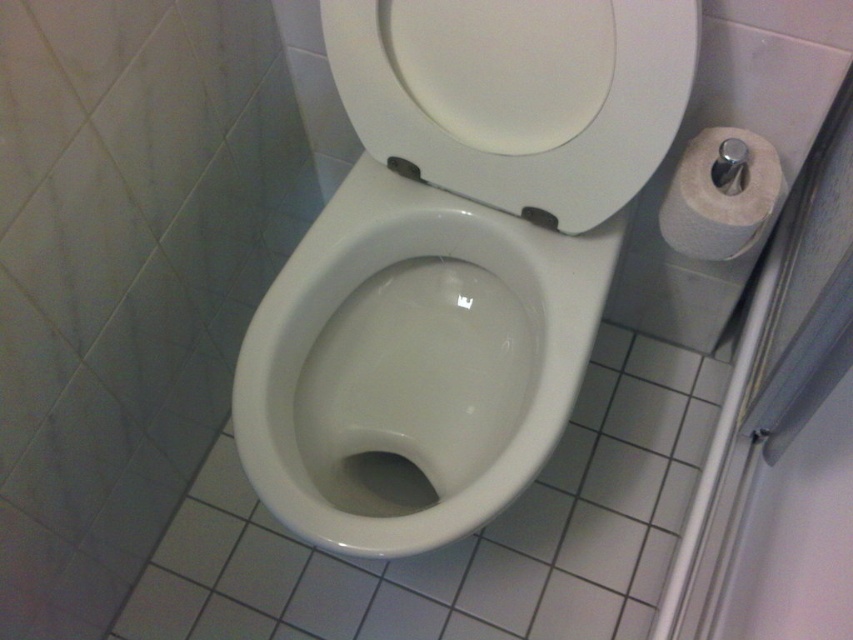
Question: Where is white glossy toilet bowl at center located in relation to white glossy toilet seat at center in the image?

Choices:
 (A) above
 (B) below

Answer: (B)

Question: Which point is farther to the camera?

Choices:
 (A) (758, 220)
 (B) (341, 264)

Answer: (B)

Question: Which object is positioned farthest from the white glossy toilet at center?

Choices:
 (A) white paper at right
 (B) white glossy toilet seat at center

Answer: (A)

Question: In this image, where is white glossy toilet at center located relative to white glossy toilet seat at center?

Choices:
 (A) right
 (B) left

Answer: (B)

Question: Among these objects, which one is farthest from the camera?

Choices:
 (A) white glossy toilet bowl at center
 (B) white glossy toilet at center
 (C) white paper at right
 (D) white glossy toilet seat at center

Answer: (A)

Question: Can you confirm if white glossy toilet at center is wider than white paper at right?

Choices:
 (A) yes
 (B) no

Answer: (A)